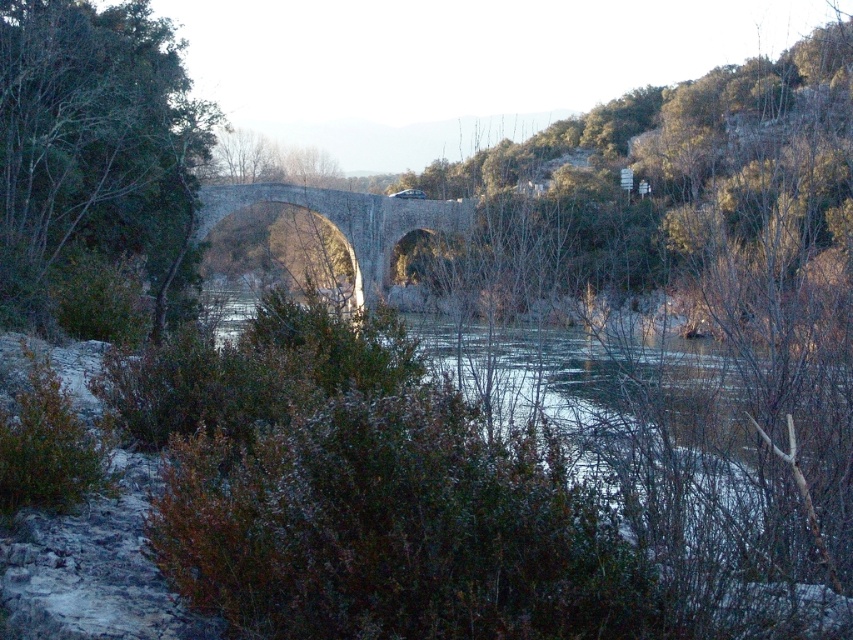
You are standing on the stone bridge and want to take a photo of the green leafy tree at center. Which direction should you face to capture it in your view?

The green leafy tree at center is located at point coordinates, so you should face towards the center of the bridge to capture it in your view.

You are a painter setting up your easel to capture the scene of the green leafy tree at center and the stone bridge at center. Which object should you focus on if you want to paint the larger one first?

The stone bridge at center is larger than the green leafy tree at center, so you should focus on painting the stone bridge at center first.

You are standing at the start of the stone bridge and want to reach the green leafy tree at center. The bridge is 25 meters long. Can you walk the entire length of the bridge to reach the tree?

The green leafy tree at center is 22.93 meters away from the viewer. Since the bridge is 25 meters long, you can walk the entire length of the bridge and reach the tree, as the distance to the tree is shorter than the bridge length.